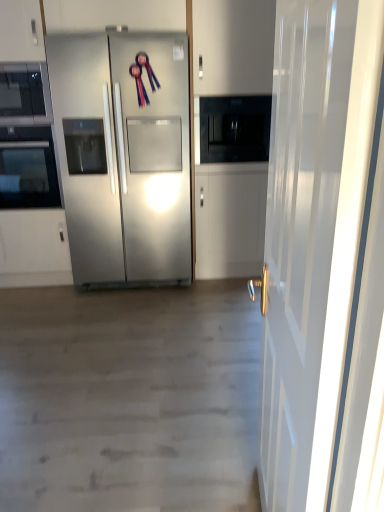
Question: From the image's perspective, is matte black microwave at upper left below black glass oven at left?

Choices:
 (A) yes
 (B) no

Answer: (B)

Question: From the image's perspective, would you say matte black microwave at upper left is positioned over black glass oven at left?

Choices:
 (A) no
 (B) yes

Answer: (B)

Question: Would you say matte black microwave at upper left is outside black glass oven at left?

Choices:
 (A) yes
 (B) no

Answer: (A)

Question: Are matte black microwave at upper left and black glass oven at left located far from each other?

Choices:
 (A) yes
 (B) no

Answer: (B)

Question: Does matte black microwave at upper left come behind black glass oven at left?

Choices:
 (A) yes
 (B) no

Answer: (B)

Question: Is stainless steel refrigerator at center inside or outside of matte black microwave at upper left?

Choices:
 (A) outside
 (B) inside

Answer: (A)

Question: Is stainless steel refrigerator at center bigger or smaller than matte black microwave at upper left?

Choices:
 (A) small
 (B) big

Answer: (B)

Question: Is stainless steel refrigerator at center in front of or behind matte black microwave at upper left in the image?

Choices:
 (A) behind
 (B) front

Answer: (B)

Question: Is point (61, 48) closer or farther from the camera than point (13, 67)?

Choices:
 (A) closer
 (B) farther

Answer: (A)

Question: From a real-world perspective, is white glossy door at right physically located above or below stainless steel refrigerator at center?

Choices:
 (A) below
 (B) above

Answer: (A)

Question: Looking at their shapes, would you say white glossy door at right is wider or thinner than stainless steel refrigerator at center?

Choices:
 (A) wide
 (B) thin

Answer: (B)

Question: Is point (294, 354) closer or farther from the camera than point (142, 267)?

Choices:
 (A) closer
 (B) farther

Answer: (A)

Question: Visually, is white glossy door at right positioned to the left or to the right of stainless steel refrigerator at center?

Choices:
 (A) left
 (B) right

Answer: (B)

Question: In terms of size, does matte black microwave at upper left appear bigger or smaller than black glass oven at left?

Choices:
 (A) big
 (B) small

Answer: (B)

Question: Is matte black microwave at upper left situated inside black glass oven at left or outside?

Choices:
 (A) outside
 (B) inside

Answer: (A)